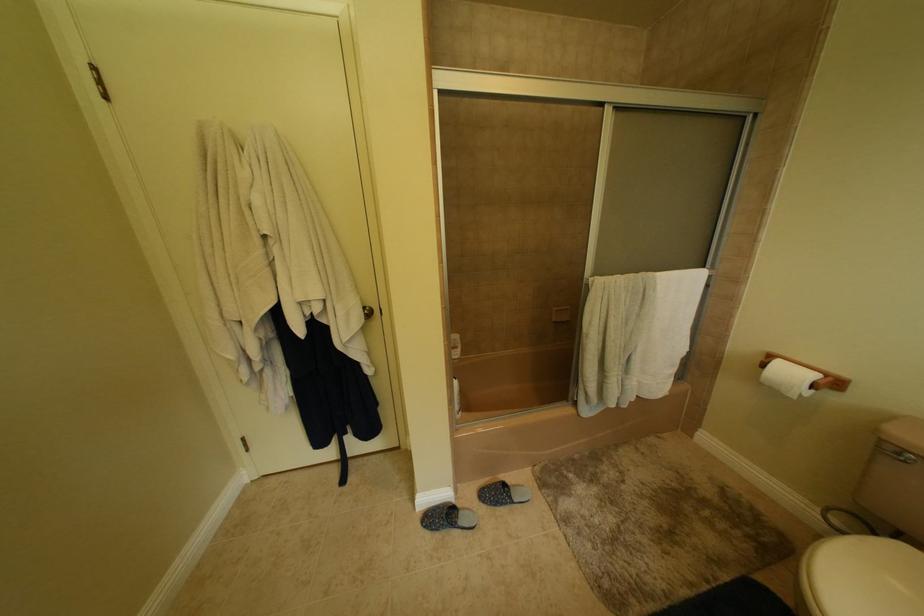
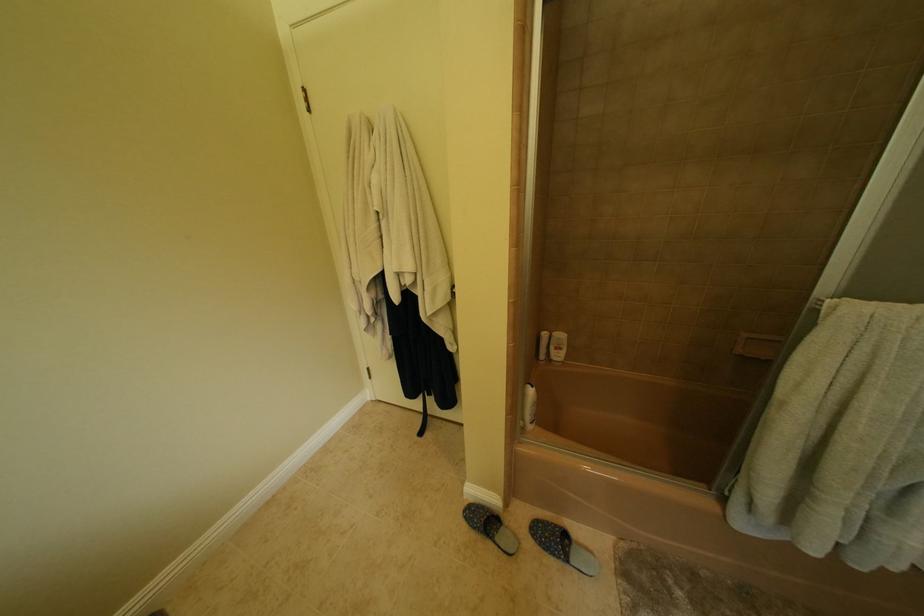
Question: The camera is either moving clockwise (left) or counter-clockwise (right) around the object. The first image is from the beginning of the video and the second image is from the end. Is the camera moving left or right when shooting the video?

Choices:
 (A) Left
 (B) Right

Answer: (B)